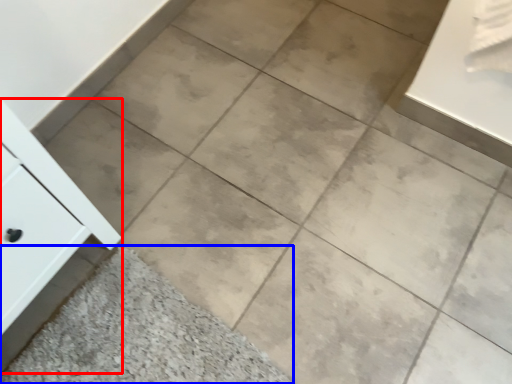
Question: Which object is closer to the camera taking this photo, cabinetry (highlighted by a red box) or ceramic tile (highlighted by a blue box)?

Choices:
 (A) cabinetry
 (B) ceramic tile

Answer: (A)